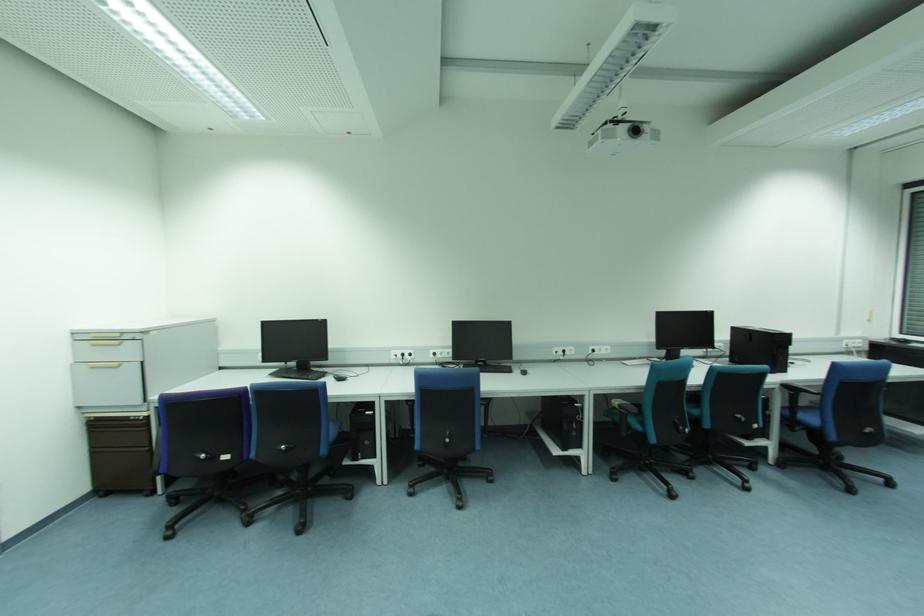
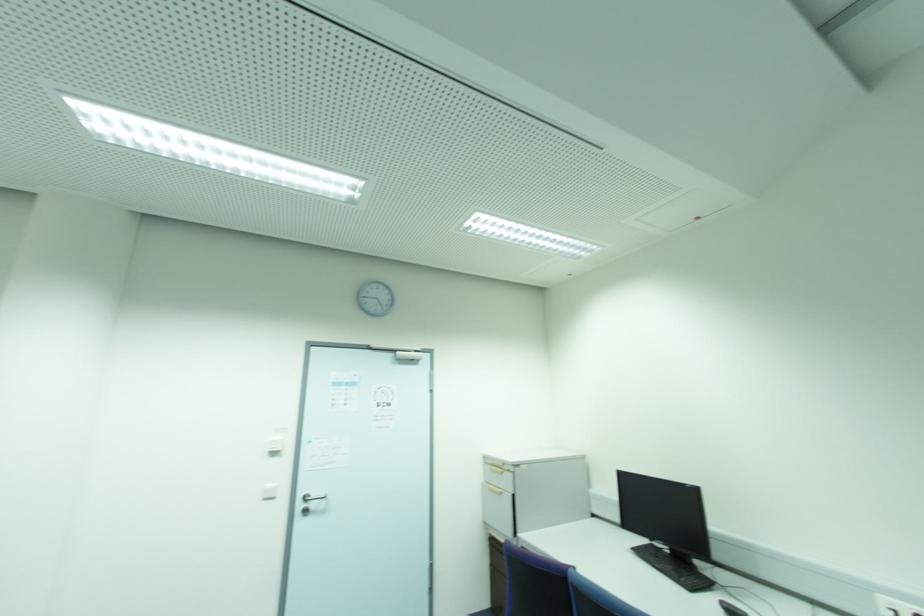
Question: I am providing you with two images of the same scene from different viewpoints. Which of the following objects are not visible in image2?

Choices:
 (A) black computer mouse
 (B) white light switch
 (C) silver door handle
 (D) none of these

Answer: (D)